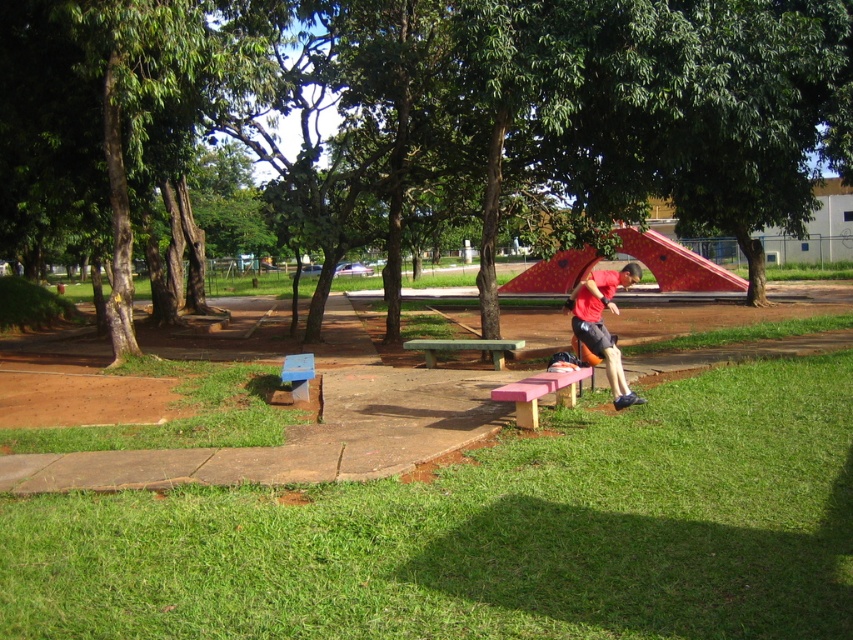
Question: Which of these objects is positioned closest to the matte red shirt at center?

Choices:
 (A) green wooden bench at center
 (B) pink wood bench at lower center

Answer: (B)

Question: Is green leafy tree at center to the left of matte red shirt at center from the viewer's perspective?

Choices:
 (A) no
 (B) yes

Answer: (B)

Question: Is green leafy tree at center above matte red shirt at center?

Choices:
 (A) no
 (B) yes

Answer: (B)

Question: Which point is farther from the camera taking this photo?

Choices:
 (A) (38, 225)
 (B) (585, 330)

Answer: (A)

Question: Estimate the real-world distances between objects in this image. Which object is closer to the green leafy tree at center?

Choices:
 (A) green wooden bench at center
 (B) blue plastic bench at lower left
 (C) matte red shirt at center

Answer: (A)

Question: In this image, where is green leafy tree at center located relative to matte red shirt at center?

Choices:
 (A) below
 (B) above

Answer: (B)